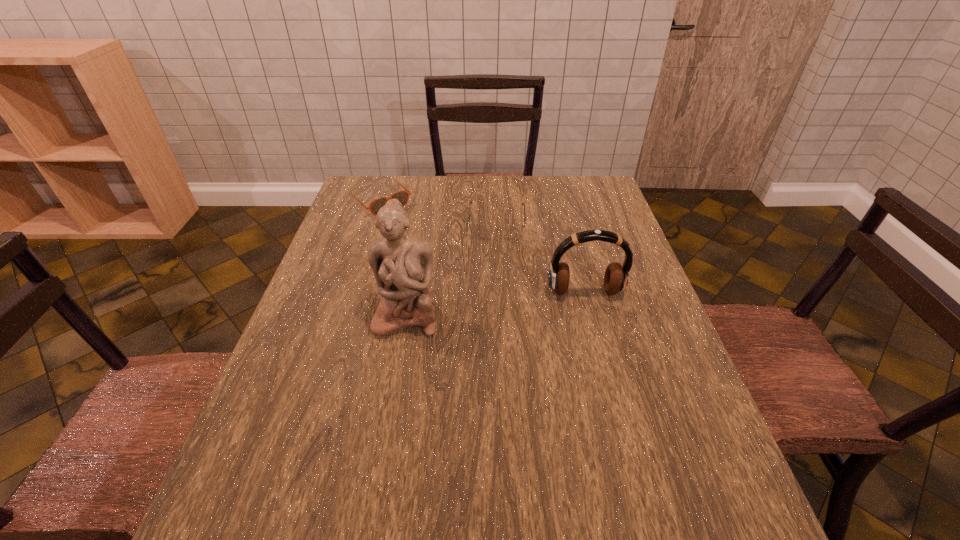
You are a GUI agent. You are given a task and a screenshot of the screen. Output one action in this format:
    pyautogui.click(x=<x>, y=<y>)
    Task: Click on the vacant point located between the rightmost object and the spectacles
    
    Given the screenshot: What is the action you would take?
    pyautogui.click(x=540, y=258)

Where is `empty space between the tallest object and the rightmost object`? This screenshot has width=960, height=540. empty space between the tallest object and the rightmost object is located at coordinates (495, 304).

Identify which object is the closest to the spectacles. Please provide its 2D coordinates. Your answer should be formatted as a tuple, i.e. [(x, y)], where the tuple contains the x and y coordinates of a point satisfying the conditions above.

[(402, 196)]

Where is `the second closest object to the spectacles`? The width and height of the screenshot is (960, 540). the second closest object to the spectacles is located at coordinates coord(616,275).

Image resolution: width=960 pixels, height=540 pixels. Identify the location of free point that satisfies the following two spatial constraints: 1. on the front side of the third object from left to right; 2. on the right side of the sunglasses. (372, 224).